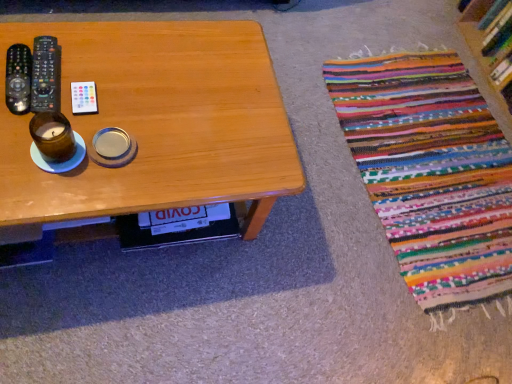
Where is `free space in front of brown glass candle at left`? This screenshot has width=512, height=384. free space in front of brown glass candle at left is located at coordinates (34, 193).